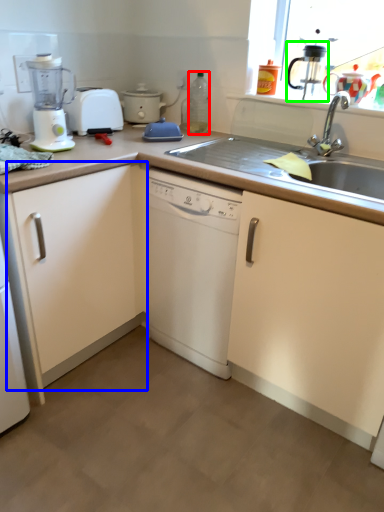
Question: Based on their relative distances, which object is nearer to bottle (highlighted by a red box)? Choose from cabinetry (highlighted by a blue box) and coffee machine (highlighted by a green box).

Choices:
 (A) cabinetry
 (B) coffee machine

Answer: (B)